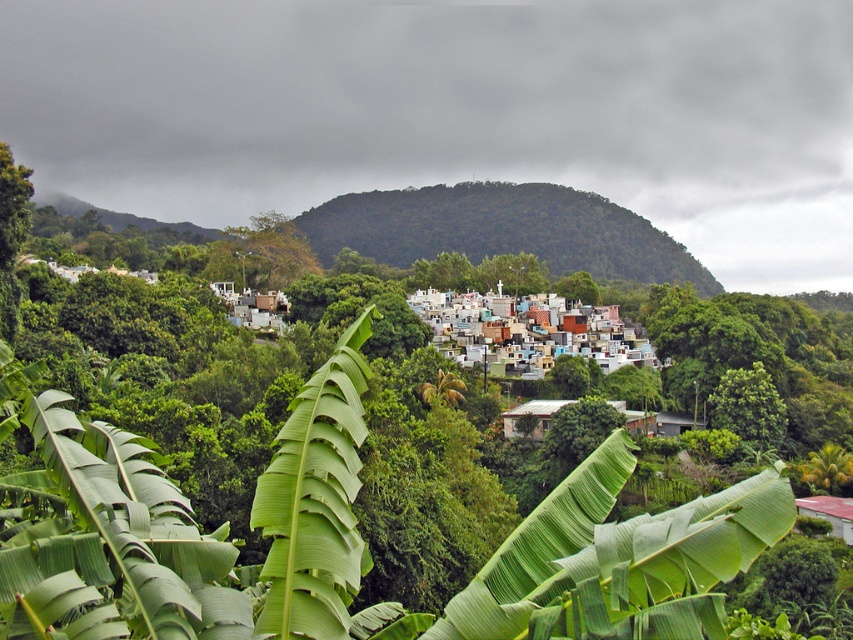
Question: Where is dark green forested hillside at center located in relation to multicolored painted houses at center in the image?

Choices:
 (A) right
 (B) left

Answer: (A)

Question: Is dark green forested hillside at center to the left of multicolored painted houses at center from the viewer's perspective?

Choices:
 (A) no
 (B) yes

Answer: (A)

Question: Which point is closer to the camera?

Choices:
 (A) (756, 428)
 (B) (538, 353)
 (C) (523, 202)
 (D) (564, 490)

Answer: (D)

Question: Which point is closer to the camera?

Choices:
 (A) green leafy tree at center-right
 (B) green leafy banana tree at center
 (C) multicolored painted houses at center
 (D) dark green forested hillside at center

Answer: (B)

Question: Which point is farther to the camera?

Choices:
 (A) (33, 515)
 (B) (505, 310)
 (C) (606, 246)
 (D) (775, 404)

Answer: (C)

Question: Can you confirm if green leafy banana tree at center is smaller than dark green forested hillside at center?

Choices:
 (A) no
 (B) yes

Answer: (B)